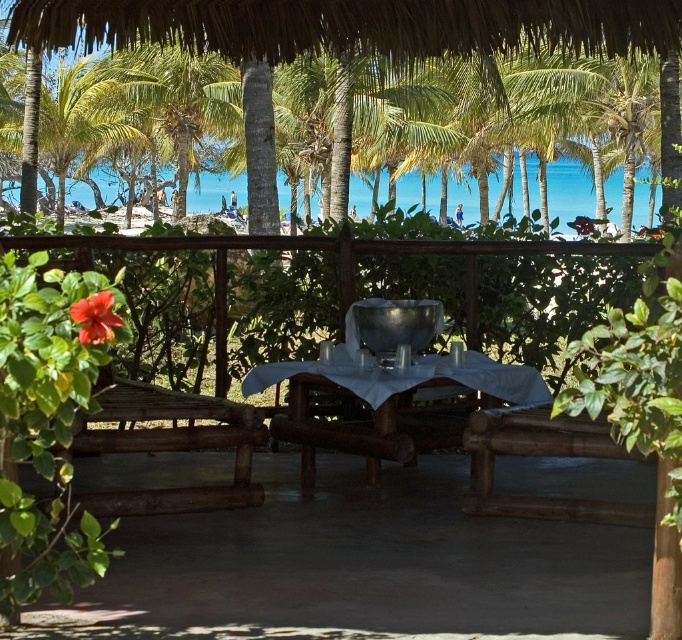
Who is higher up, metallic silver bowl at center or brown wood chair at center?

brown wood chair at center is above.

Between metallic silver bowl at center and brown wood chair at center, which one has more height?

brown wood chair at center is taller.

Find the location of a particular element. metallic silver bowl at center is located at coordinates (572, 499).

Consider the image. Which of these two, metallic silver bowl at center or green leafy palm tree at upper left, stands taller?

green leafy palm tree at upper left

This screenshot has width=682, height=640. Describe the element at coordinates (572, 499) in the screenshot. I see `metallic silver bowl at center` at that location.

Which is in front, point (415, 422) or point (44, 102)?

Point (415, 422) is more forward.

The image size is (682, 640). Identify the location of metallic silver bowl at center. (572, 499).

Image resolution: width=682 pixels, height=640 pixels. What do you see at coordinates (391, 403) in the screenshot?
I see `white cloth-covered table at center` at bounding box center [391, 403].

Which is below, white cloth-covered table at center or brown wood chair at center?

Positioned lower is white cloth-covered table at center.

Locate an element on the screen. Image resolution: width=682 pixels, height=640 pixels. white cloth-covered table at center is located at coordinates click(x=391, y=403).

Where is `white cloth-covered table at center`? white cloth-covered table at center is located at coordinates (391, 403).